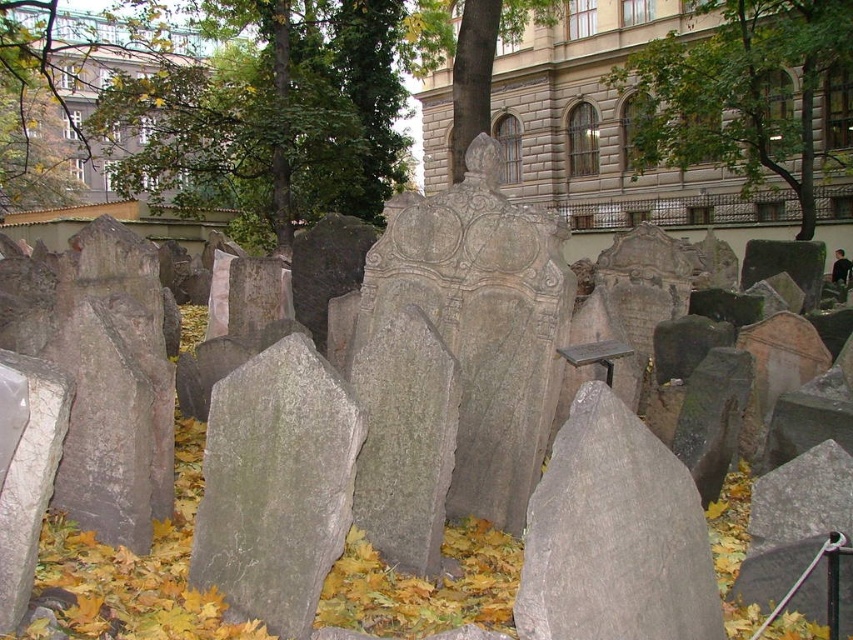
You are a photographer planning to capture the gray rough stone at center and the green leafy tree at upper center in a single frame. Based on their sizes in the image, which object would you need to position closer to the camera to ensure both are visible in the frame?

The gray rough stone at center occupies less space than the green leafy tree at upper center, so you should position the gray rough stone at center closer to the camera to ensure both fit within the frame.

You are standing at the entrance of the cemetery and want to locate the green leafy tree at upper center. According to the coordinates given, where should you look?

The green leafy tree at upper center is located at coordinates point (740, 92).